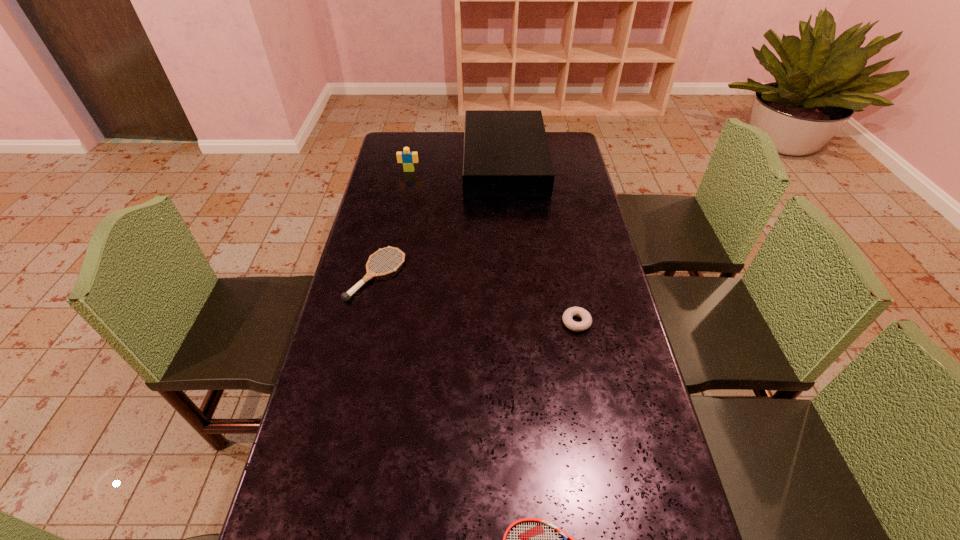
I want to click on free location that satisfies the following two spatial constraints: 1. on the face of the doughnut; 2. on the right side of the Lego, so click(378, 322).

In order to click on vacant space that satisfies the following two spatial constraints: 1. at the front of the doughnut for disc insertion; 2. on the left side of the CD player in this screenshot , I will do `click(516, 322)`.

This screenshot has width=960, height=540. I want to click on vacant region that satisfies the following two spatial constraints: 1. at the front of the CD player for disc insertion; 2. on the face of the Lego, so click(x=505, y=171).